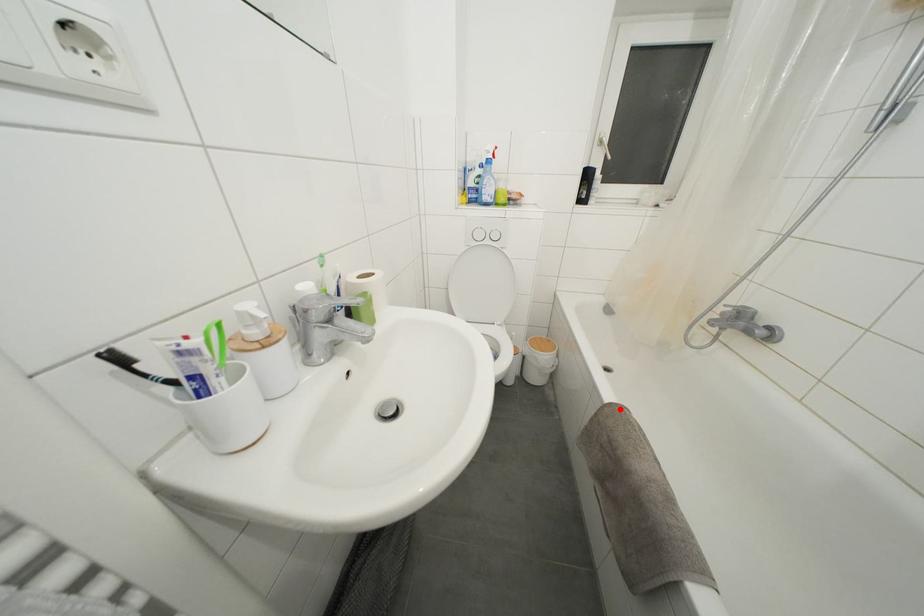
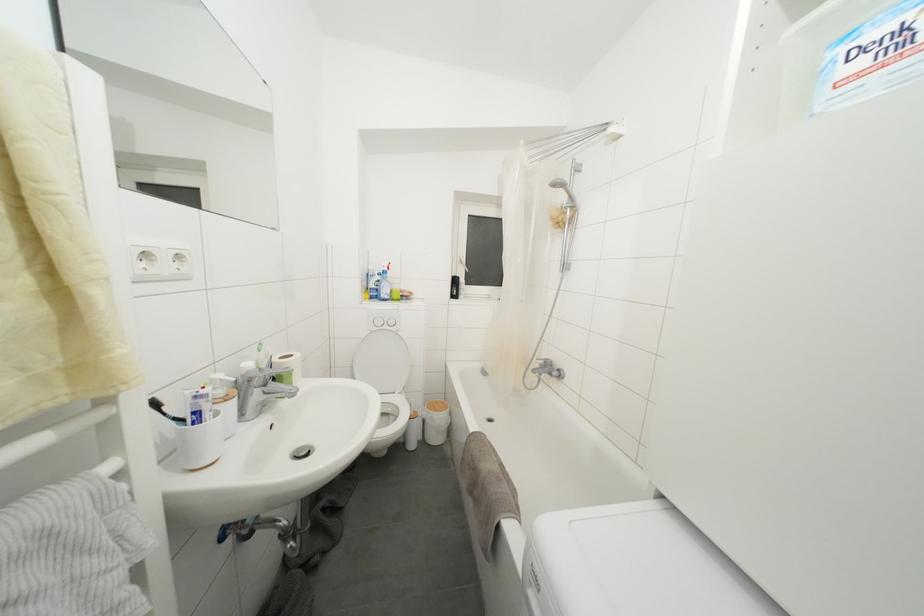
Question: I am providing you with two images of the same scene from different viewpoints. In image1, a red point is highlighted. Considering the same 3D point in image2, which of the following is correct?

Choices:
 (A) It is closer
 (B) It is farther

Answer: (B)